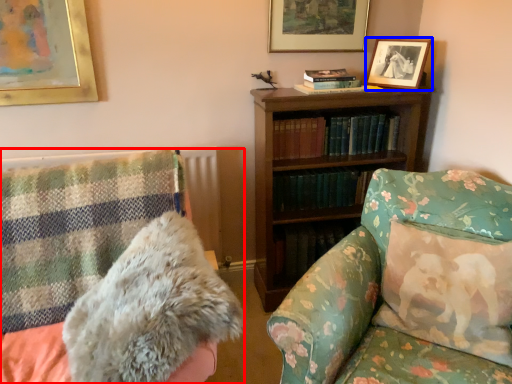
Question: Among these objects, which one is nearest to the camera, furniture (highlighted by a red box) or picture frame (highlighted by a blue box)?

Choices:
 (A) furniture
 (B) picture frame

Answer: (A)